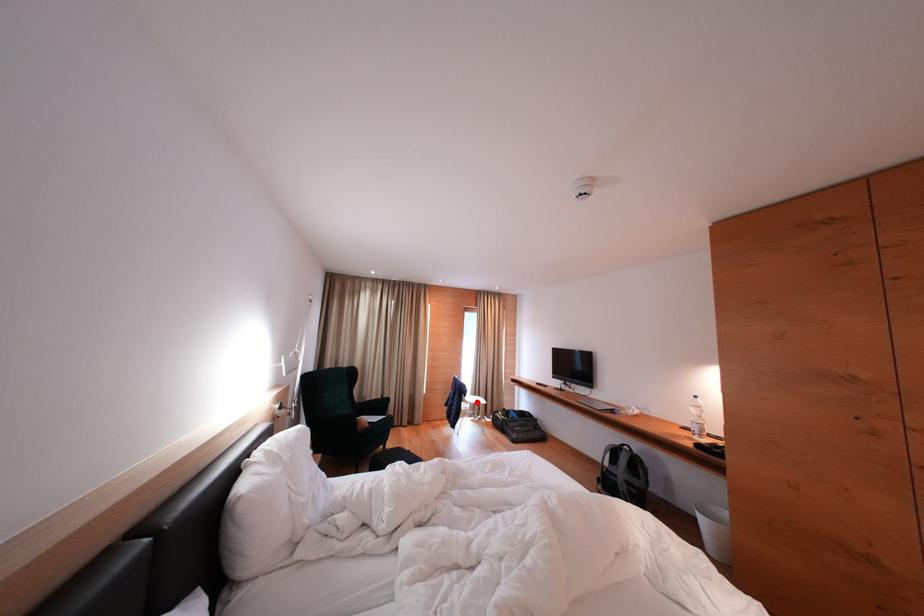
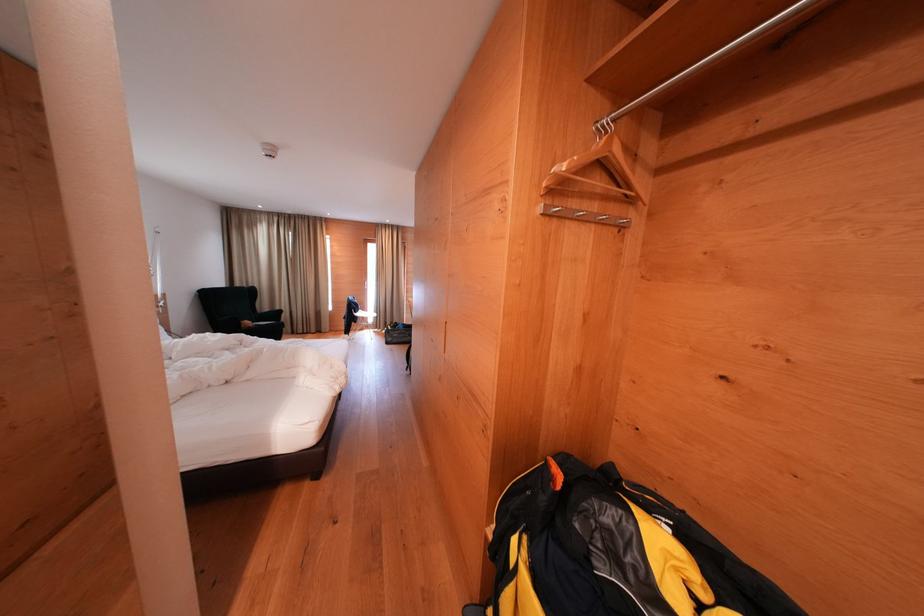
Locate, in the second image, the point that corresponds to the highlighted location in the first image.

(374, 318)